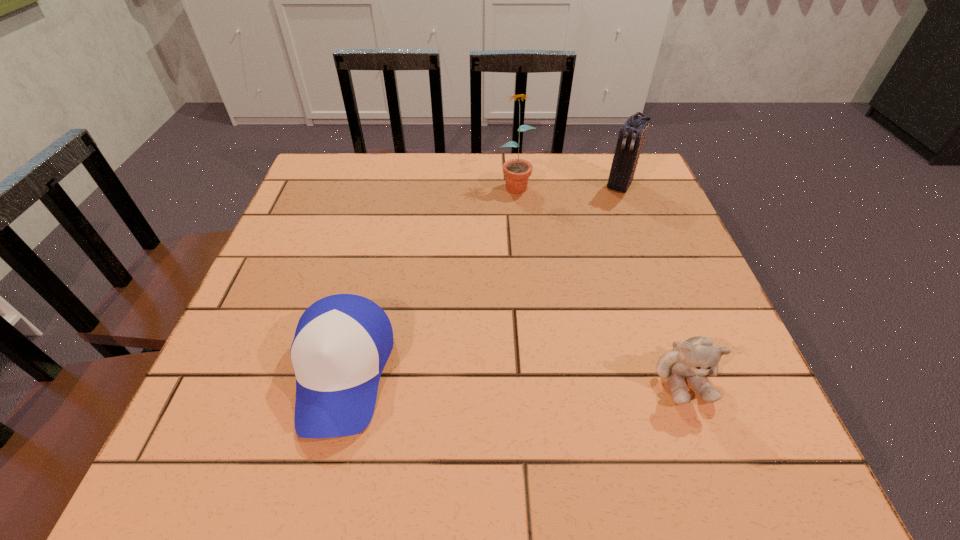
Locate an element on the screen. baseball cap is located at coordinates (342, 342).

Find the location of `teddy bear`. teddy bear is located at coordinates (696, 357).

Where is `the second object from left to right`? The width and height of the screenshot is (960, 540). the second object from left to right is located at coordinates (517, 171).

Where is `the tallest object`? The width and height of the screenshot is (960, 540). the tallest object is located at coordinates (517, 171).

Identify the location of the third shortest object. The height and width of the screenshot is (540, 960). (631, 136).

Locate an element on the screen. free location located on the flower of the sunflower is located at coordinates (527, 248).

Identify the location of vacant space located 0.120m on the flower of the sunflower. This screenshot has width=960, height=540. click(x=522, y=226).

Image resolution: width=960 pixels, height=540 pixels. In order to click on blank space located on the flower of the sunflower in this screenshot , I will do `click(536, 294)`.

This screenshot has height=540, width=960. Find the location of `free point located 0.100m with the zip open on the second tallest object`. free point located 0.100m with the zip open on the second tallest object is located at coordinates (601, 215).

Image resolution: width=960 pixels, height=540 pixels. Find the location of `free space located with the zip open on the second tallest object`. free space located with the zip open on the second tallest object is located at coordinates (604, 211).